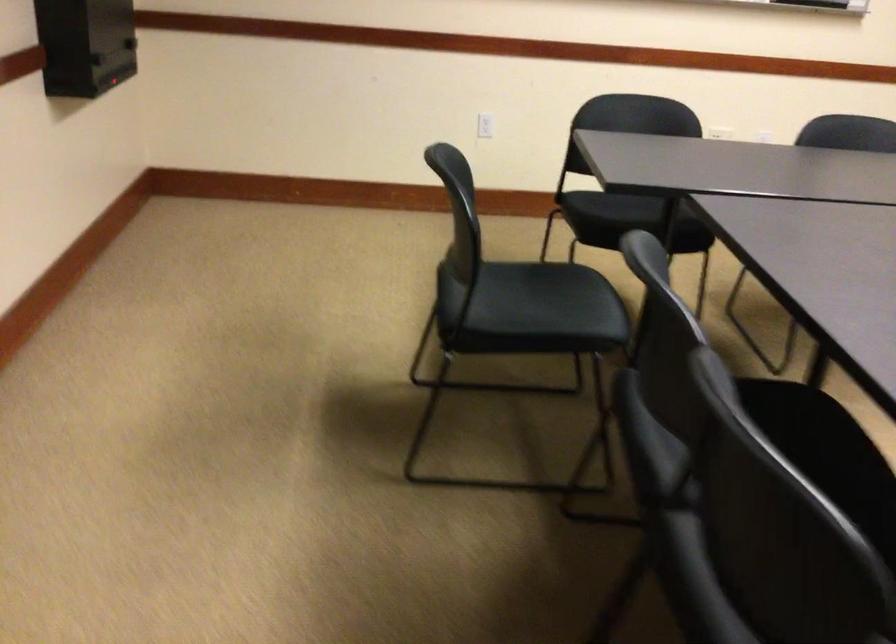
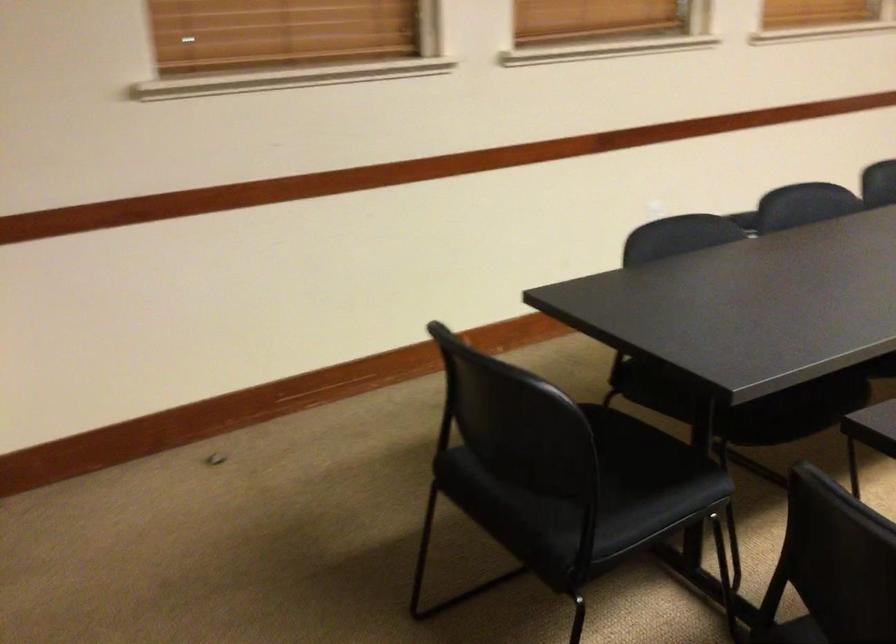
In the scene shown: How did the camera likely rotate?

The camera rotated toward right-down.